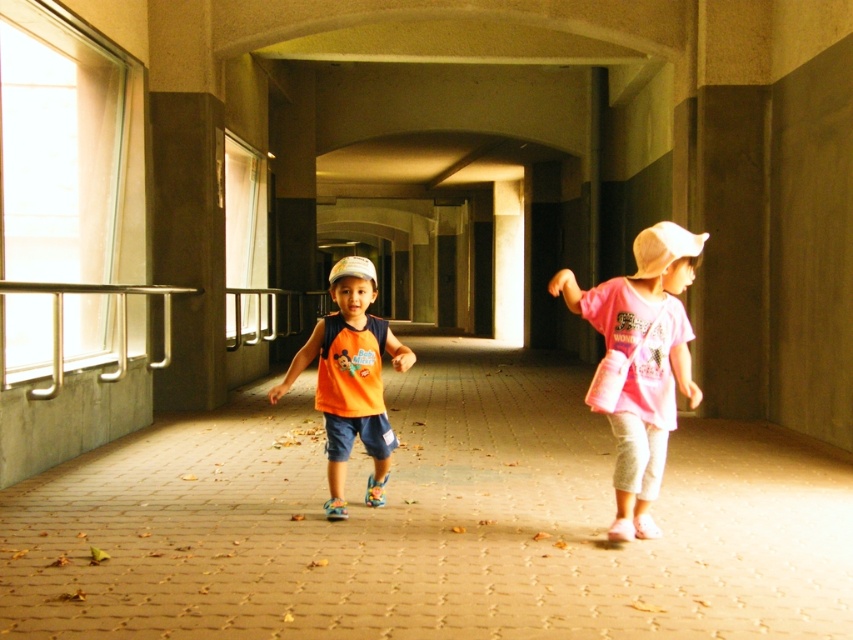
Is brown brick pavement at center above orange matte tank top at center?

No, brown brick pavement at center is not above orange matte tank top at center.

Does brown brick pavement at center appear on the left side of orange matte tank top at center?

In fact, brown brick pavement at center is to the right of orange matte tank top at center.

Where is `brown brick pavement at center`? brown brick pavement at center is located at coordinates (430, 522).

Is pink cotton shirt at right behind orange matte tank top at center?

That is False.

Which is above, pink cotton shirt at right or orange matte tank top at center?

pink cotton shirt at right is higher up.

Is point (682, 228) more distant than point (376, 369)?

No, (682, 228) is closer to viewer.

The image size is (853, 640). What are the coordinates of `pink cotton shirt at right` in the screenshot? It's located at (643, 360).

Is brown brick pavement at center wider than pink cotton shirt at right?

Yes.

Can you confirm if brown brick pavement at center is thinner than pink cotton shirt at right?

In fact, brown brick pavement at center might be wider than pink cotton shirt at right.

The width and height of the screenshot is (853, 640). I want to click on brown brick pavement at center, so click(430, 522).